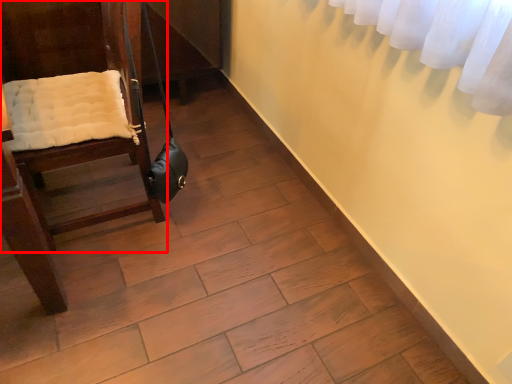
Question: From the image's perspective, what is the correct spatial relationship of furniture (annotated by the red box) in relation to shoulder bag?

Choices:
 (A) above
 (B) below

Answer: (A)